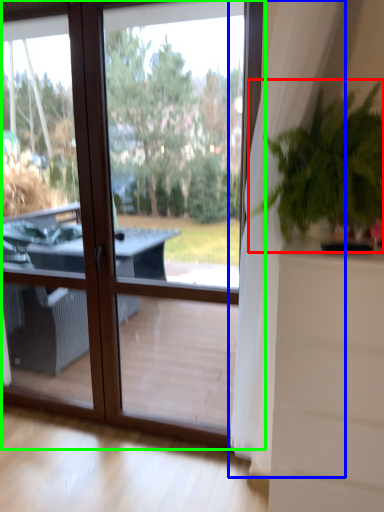
Question: Based on their relative distances, which object is farther from houseplant (highlighted by a red box)? Choose from curtain (highlighted by a blue box) and window (highlighted by a green box).

Choices:
 (A) curtain
 (B) window

Answer: (B)